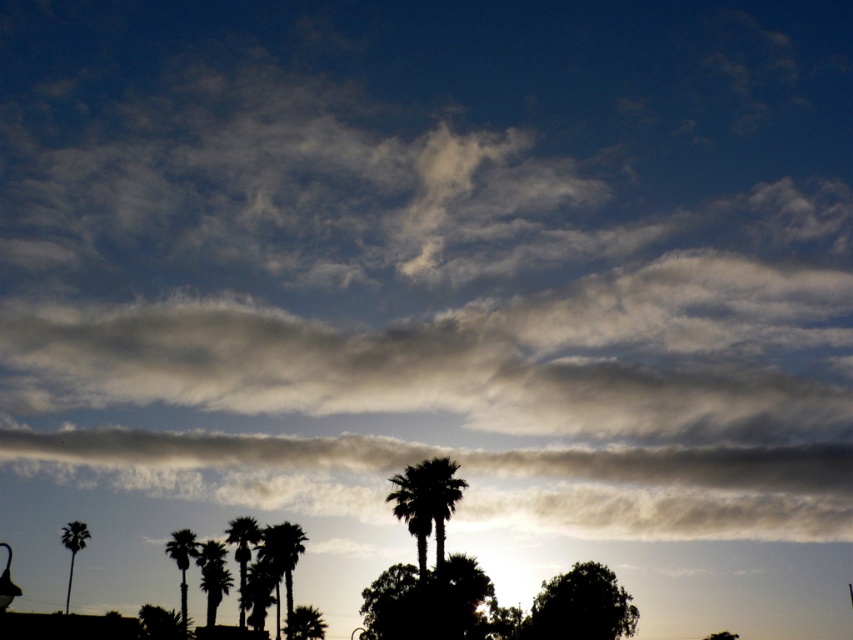
You are an artist trying to paint the scene. You want to ensure the palm trees are proportionally accurate. Which palm tree should you make narrower when comparing the dark green leafy palm tree at center and the silhouette palm tree at lower center?

The dark green leafy palm tree at center should be made narrower since its width is less than the silhouette palm tree at lower center.